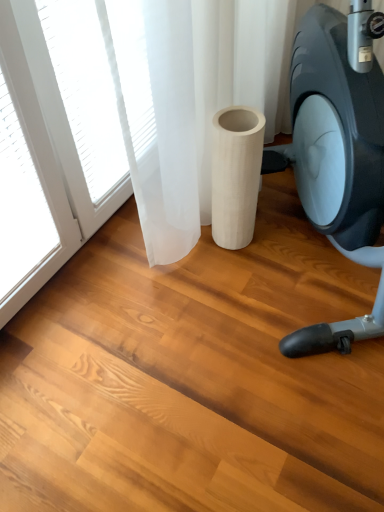
At what (x,y) coordinates should I click in order to perform the action: click on vacant space in front of white wood cylinder at center. Please return your answer as a coordinate pair (x, y). Looking at the image, I should click on (240, 276).